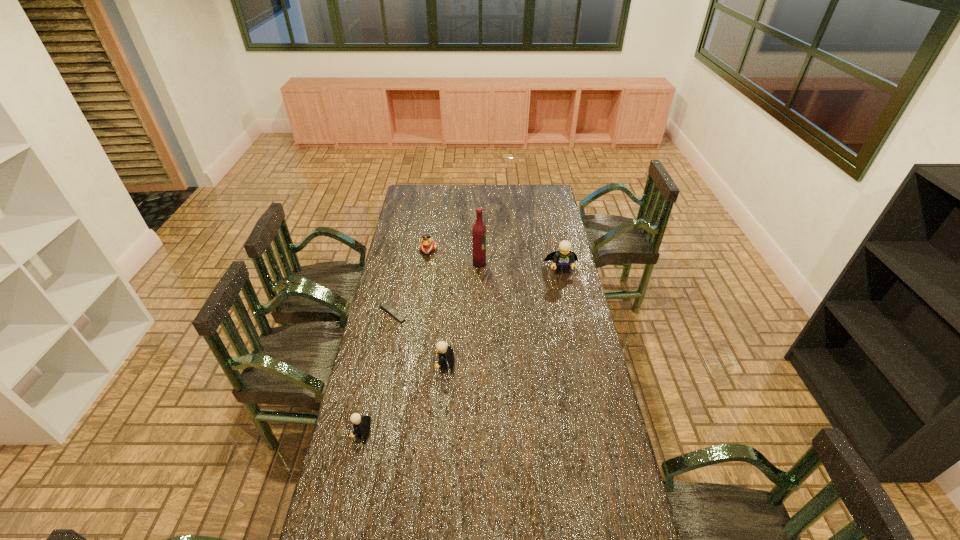
The width and height of the screenshot is (960, 540). Find the location of `the shortest object`. the shortest object is located at coordinates (384, 306).

Where is `remote control`? remote control is located at coordinates (384, 306).

The width and height of the screenshot is (960, 540). In order to click on vacant area situated 0.230m on the front-facing side of the second nearest object in this screenshot , I will do [x=376, y=364].

This screenshot has height=540, width=960. In order to click on vacant space located on the front-facing side of the second nearest object in this screenshot , I will do `click(379, 364)`.

At what (x,y) coordinates should I click in order to perform the action: click on blank space located 0.180m on the front-facing side of the second nearest object. Please return your answer as a coordinate pair (x, y). Looking at the image, I should click on (390, 364).

This screenshot has width=960, height=540. What are the coordinates of `vacant region located on the front-facing side of the tallest Lego` in the screenshot? It's located at (572, 319).

Identify the location of free spot located 0.080m on the face of the fourth object from right to left. This screenshot has width=960, height=540. (425, 266).

Locate an element on the screen. The width and height of the screenshot is (960, 540). free region located on the label of the liquor is located at coordinates (536, 264).

Where is `blank space located on the back of the remote control`? Image resolution: width=960 pixels, height=540 pixels. blank space located on the back of the remote control is located at coordinates (403, 262).

This screenshot has height=540, width=960. I want to click on Lego at the left edge, so click(x=361, y=425).